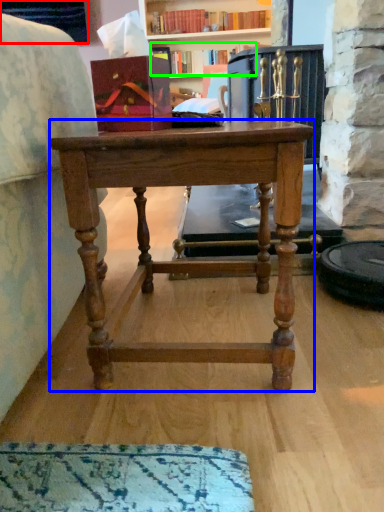
Question: Estimate the real-world distances between objects in this image. Which object is closer to cabinetry (highlighted by a red box), desk (highlighted by a blue box) or book (highlighted by a green box)?

Choices:
 (A) desk
 (B) book

Answer: (B)